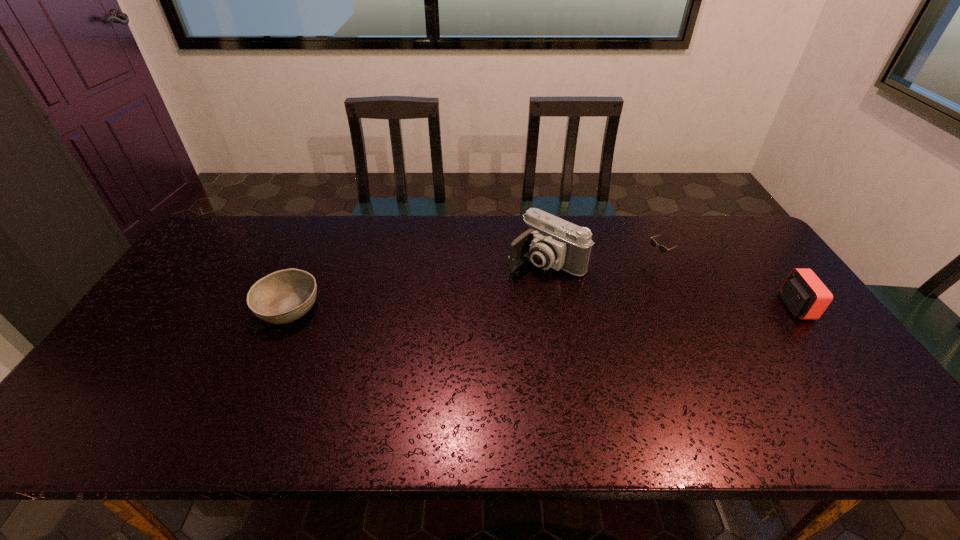
Find the location of a particular element. The height and width of the screenshot is (540, 960). vacant region between the camera and the sunglasses is located at coordinates (602, 261).

Select which object is the third closest to the bowl. Please provide its 2D coordinates. Your answer should be formatted as a tuple, i.e. [(x, y)], where the tuple contains the x and y coordinates of a point satisfying the conditions above.

[(805, 295)]

The height and width of the screenshot is (540, 960). Find the location of `object that stands as the third closest to the camera`. object that stands as the third closest to the camera is located at coordinates (805, 295).

You are a GUI agent. You are given a task and a screenshot of the screen. Output one action in this format:
    pyautogui.click(x=<x>, y=<y>)
    Task: Click on the free space that satisfies the following two spatial constraints: 1. on the back side of the bowl; 2. on the left side of the second object from left to right
    Image resolution: width=960 pixels, height=540 pixels.
    Given the screenshot: What is the action you would take?
    (310, 261)

Locate an element on the screen. The height and width of the screenshot is (540, 960). vacant position in the image that satisfies the following two spatial constraints: 1. on the front side of the sunglasses; 2. on the front-facing side of the rightmost object is located at coordinates (680, 306).

Where is `free space that satisfies the following two spatial constraints: 1. on the front side of the second object from right to left; 2. on the front-facing side of the alarm clock`? The image size is (960, 540). free space that satisfies the following two spatial constraints: 1. on the front side of the second object from right to left; 2. on the front-facing side of the alarm clock is located at coordinates (680, 306).